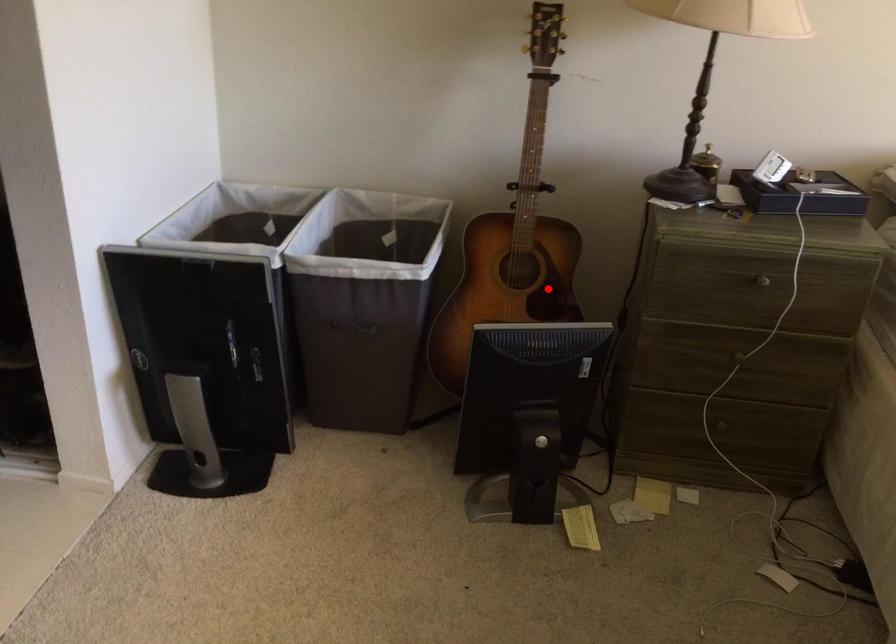
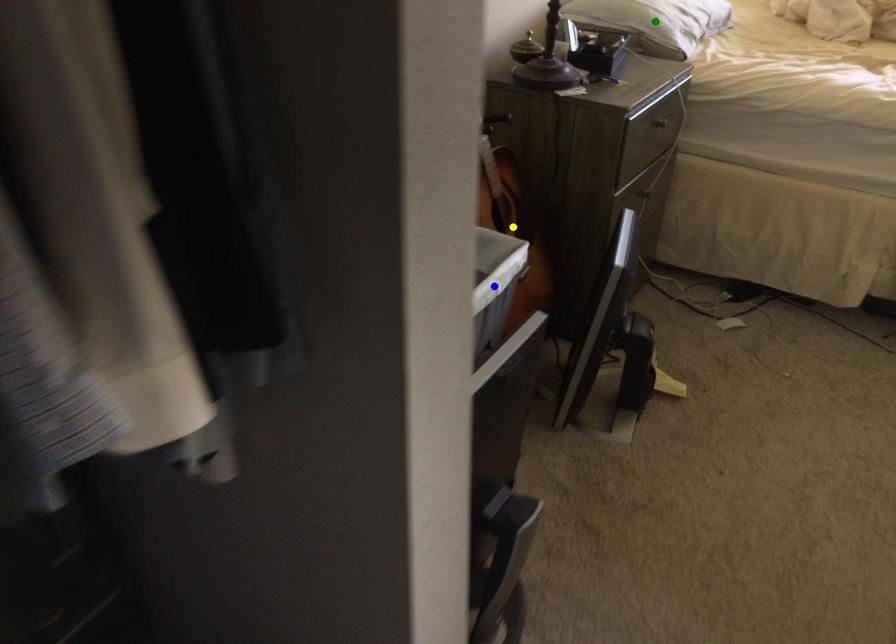
Question: I am providing you with two images of the same scene from different viewpoints. A red point is marked on the first image. You are given multiple points on the second image. Which point in image 2 represents the same 3d spot as the red point in image 1?

Choices:
 (A) green point
 (B) yellow point
 (C) blue point

Answer: (B)